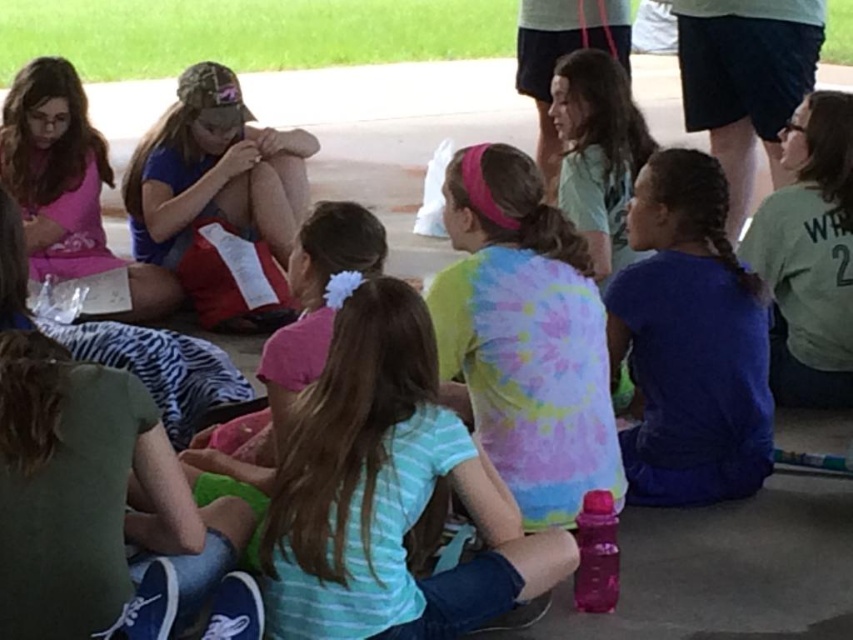
Question: Estimate the real-world distances between objects in this image. Which object is farther from the green fabric pants at lower left?

Choices:
 (A) green jersey at right
 (B) blue fabric shirt at center
 (C) matte pink shirt at upper left
 (D) matte blue shirt at center

Answer: (A)

Question: Is blue fabric shirt at center positioned at the back of green fabric pants at lower left?

Choices:
 (A) no
 (B) yes

Answer: (B)

Question: Is blue fabric shirt at center further to camera compared to matte pink shirt at upper left?

Choices:
 (A) no
 (B) yes

Answer: (A)

Question: Does striped cotton shirt at center have a lesser width compared to matte blue shirt at center?

Choices:
 (A) no
 (B) yes

Answer: (B)

Question: Which point is closer to the camera taking this photo?

Choices:
 (A) (612, 301)
 (B) (155, 122)

Answer: (A)

Question: Which point is farther to the camera?

Choices:
 (A) matte pink shirt at upper left
 (B) striped cotton shirt at center

Answer: (A)